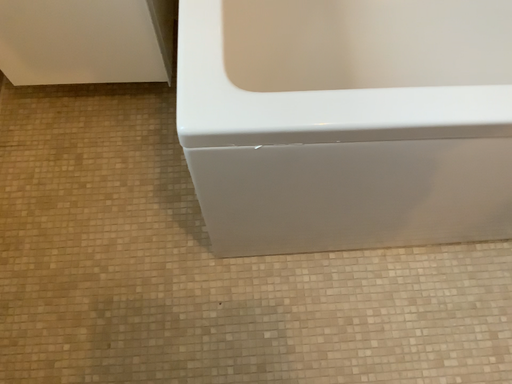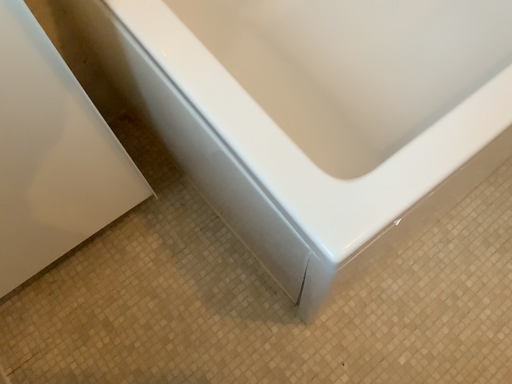
Question: How did the camera likely rotate when shooting the video?

Choices:
 (A) rotated right
 (B) rotated left

Answer: (A)